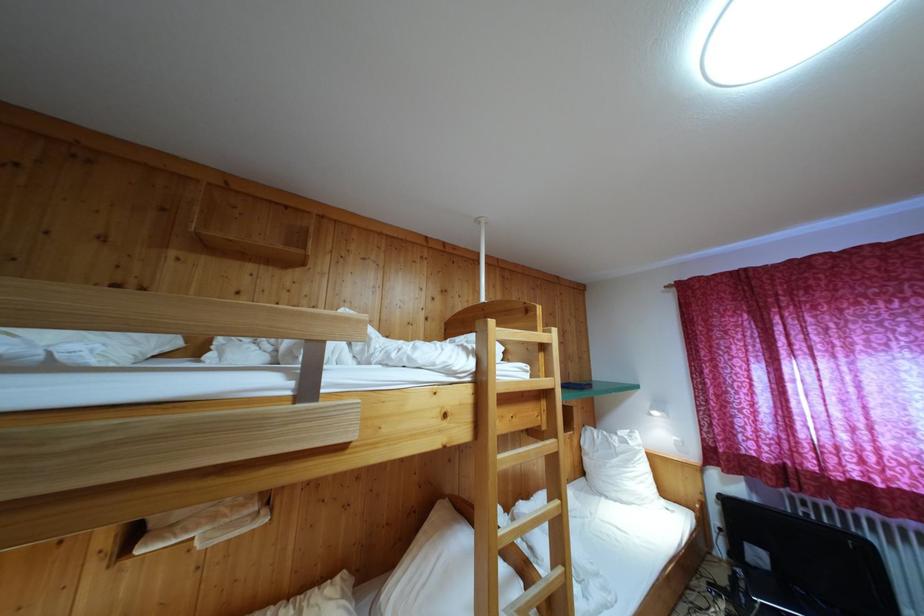
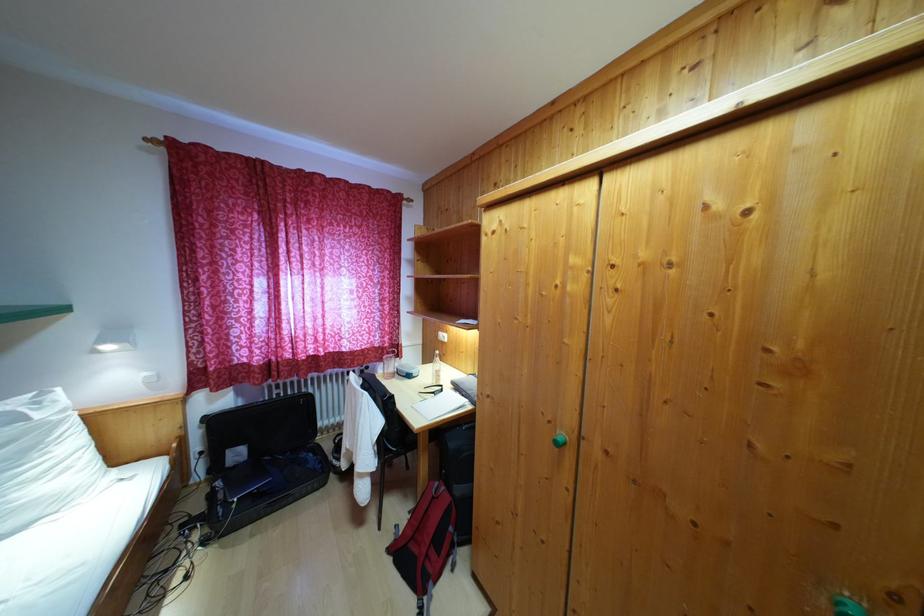
Question: The camera is either moving clockwise (left) or counter-clockwise (right) around the object. The first image is from the beginning of the video and the second image is from the end. Is the camera moving left or right when shooting the video?

Choices:
 (A) Left
 (B) Right

Answer: (A)